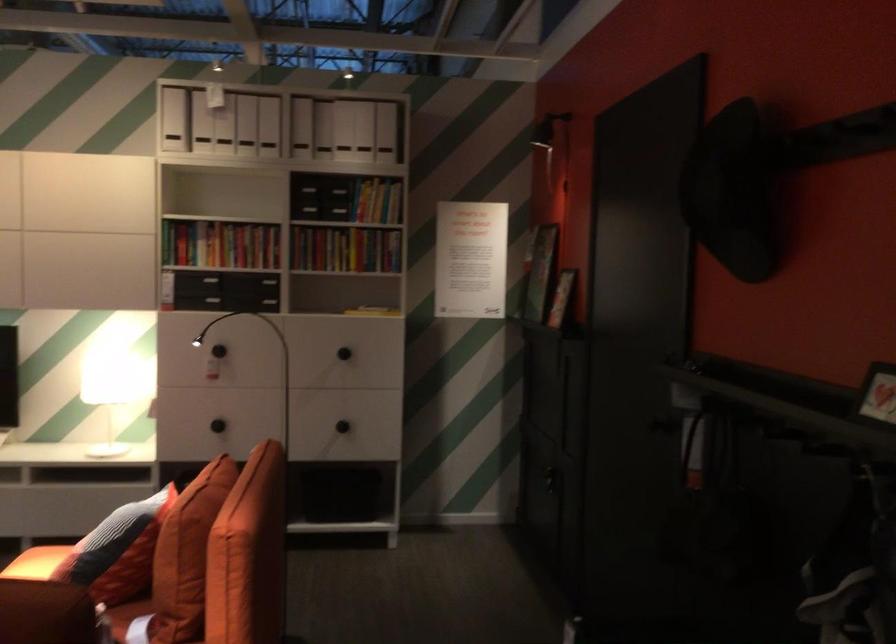
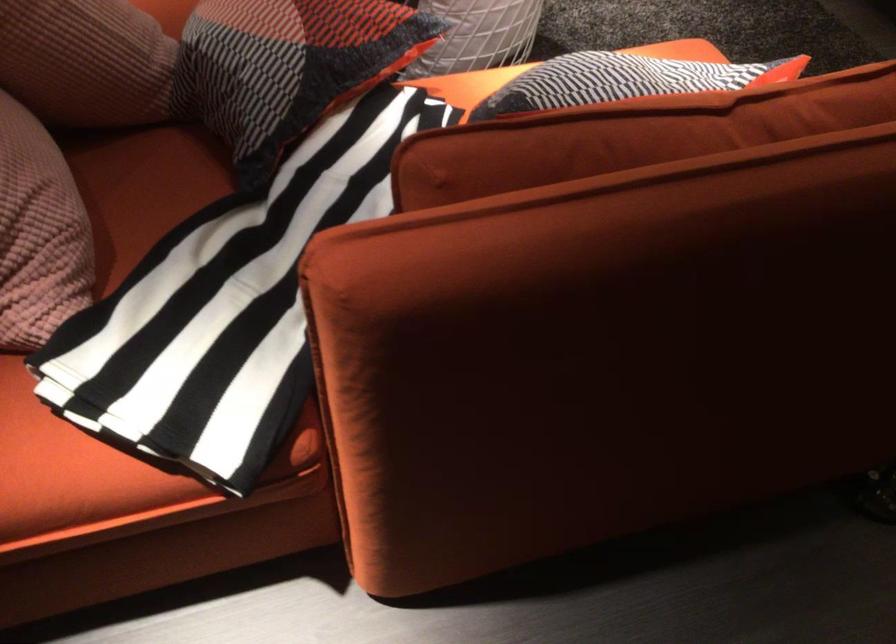
Where in the second image is the point corresponding to (269,554) from the first image?

(605, 353)